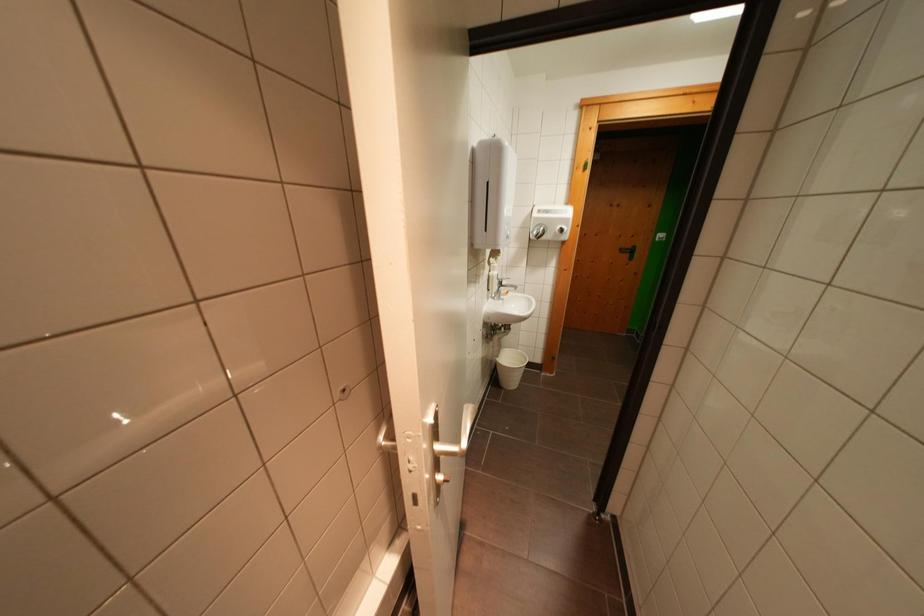
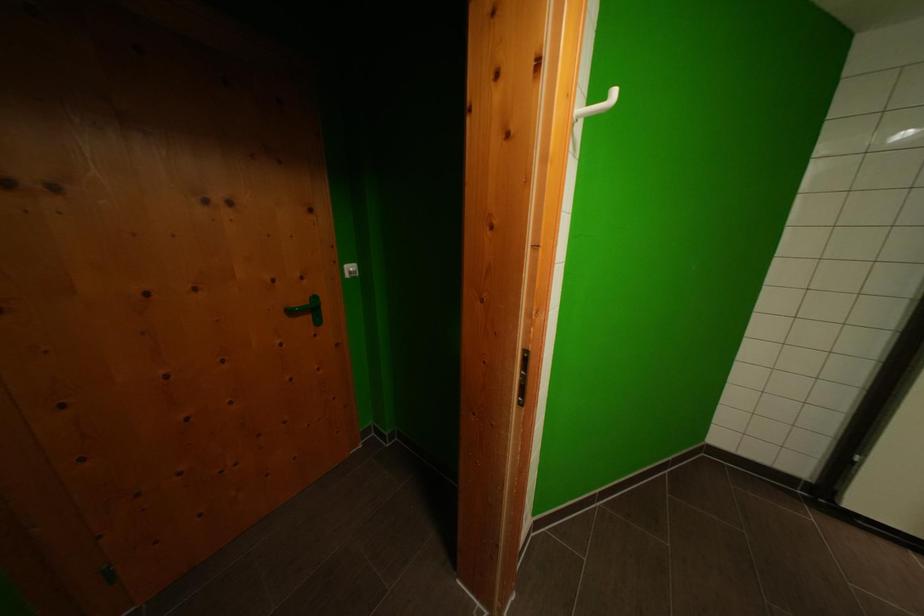
Locate, in the second image, the point that corresponds to (627,254) in the first image.

(297, 315)